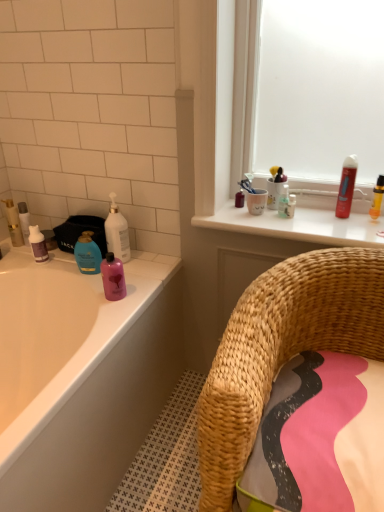
Where is `vacant space to the left of translucent plastic toothbrush at upper center, the third toiletry from the right`? Image resolution: width=384 pixels, height=512 pixels. vacant space to the left of translucent plastic toothbrush at upper center, the third toiletry from the right is located at coordinates (242, 215).